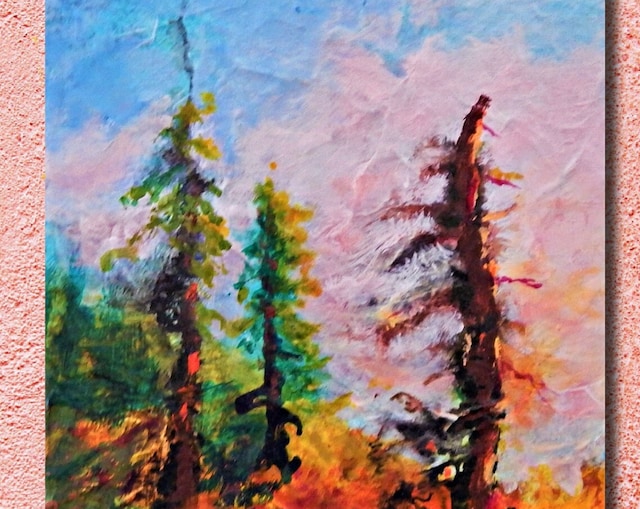
Where is `painting`? painting is located at coordinates (342, 301).